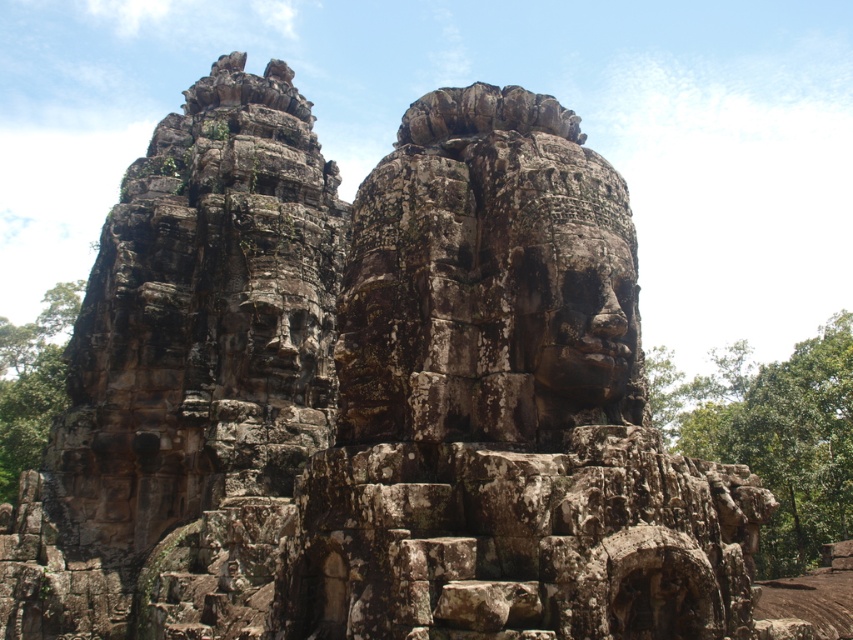
You are standing at the base of the monumental stone structure and want to take a photo of the point at coordinates (566, 278). If your camera has a maximum focus range of 150 feet, will you be able to focus on that point?

The distance of point (566, 278) from the camera is 161.93 feet, which exceeds the camera maximum focus range of 150 feet. Therefore, the camera cannot focus on that point.

Consider the image. You are standing at the base of the monumental stone structure and want to reach the large carved face at the top. There are two points marked on the structure. One is at point [787,416] and the other at point [51,401]. Which point is closer to the large carved face?

Point [787,416] is closer to the large carved face because it is in front of point [51,401].